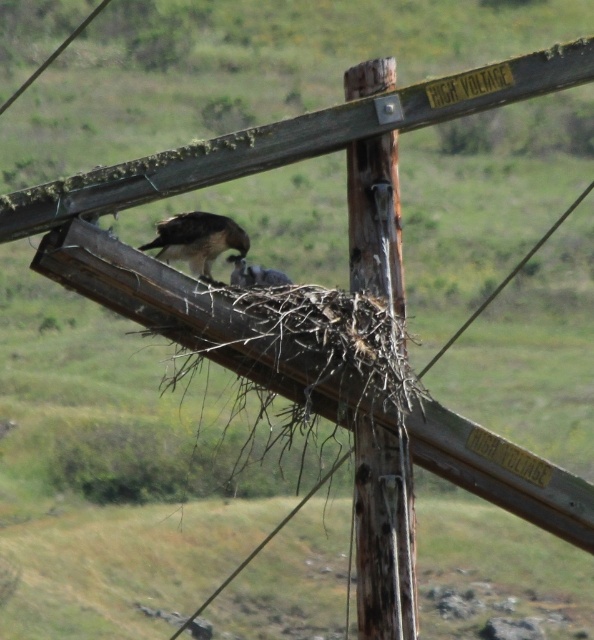
You are a birdwatcher observing the scene from a distance. You notice two points marked in the image. Which point is closer to you, point (406, 588) or point (244, 234)?

Point (406, 588) is in front of point (244, 234), so it is closer to you.

From the picture: You are standing at the origin point of a coordinate system where the image is represented. The brown wooden telegraph pole at center is located at point 0.836, 0.646. If you want to move towards the pole, in which direction should you move?

To move towards the brown wooden telegraph pole at center located at coordinates (383, 534) from the origin, you should move in the positive x and positive y directions since both coordinates are greater than zero.

You are a birdwatcher observing the scene. You notice the brown wooden telegraph pole at center and the smooth wire at upper left. Which object is smaller in size?

The brown wooden telegraph pole at center is smaller in size compared to the smooth wire at upper left according to the description.